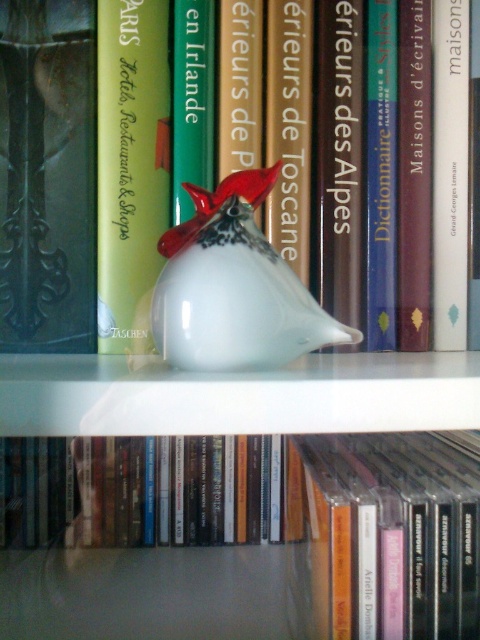
What is the 2D coordinate of the hardcover book at center?

The hardcover book at center is located at the 2D coordinate point of (245, 544).

You are organizing a bookshelf and need to place a new book that is 15 cm wide. You see the hardcover book at center and the white glass vase at center. Which object should you consider moving to accommodate the new book?

The hardcover book at center might be wider than the white glass vase at center, so moving the hardcover book at center could provide more space for the new book.